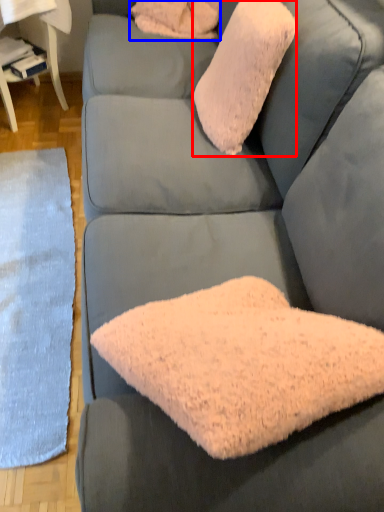
Question: Which point is further to the camera, throw pillow (highlighted by a red box) or pillow (highlighted by a blue box)?

Choices:
 (A) throw pillow
 (B) pillow

Answer: (B)